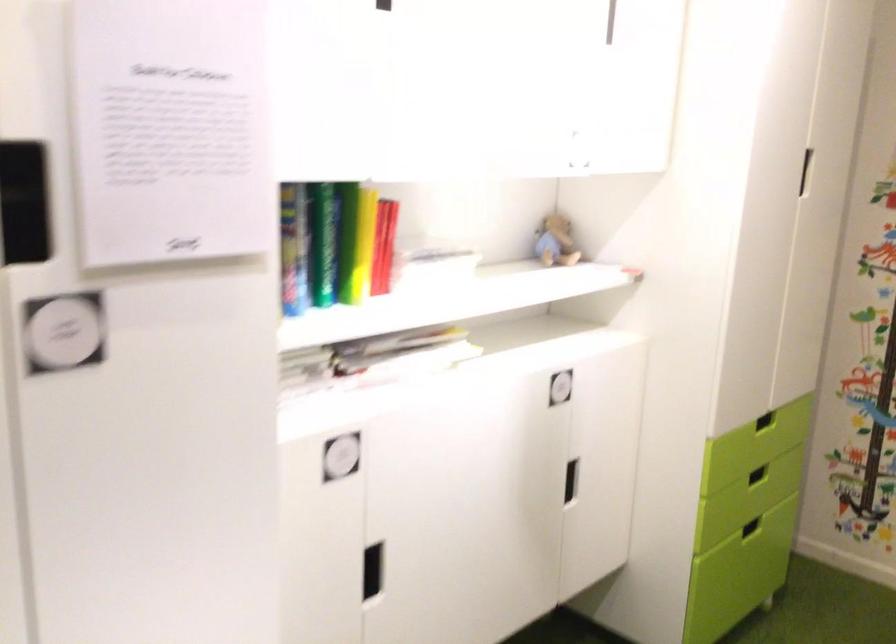
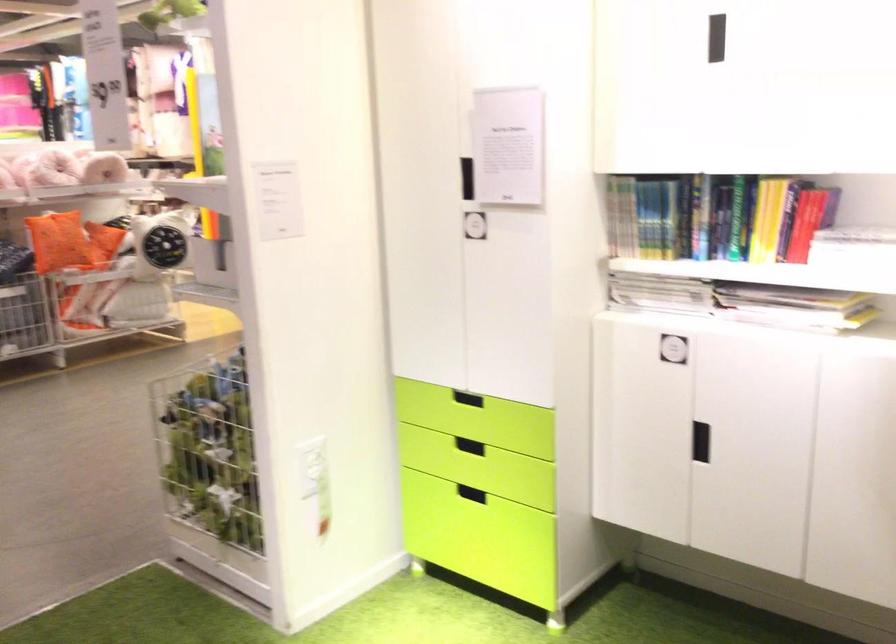
Where in the second image is the point corresponding to point 443,267 from the first image?

(853, 245)